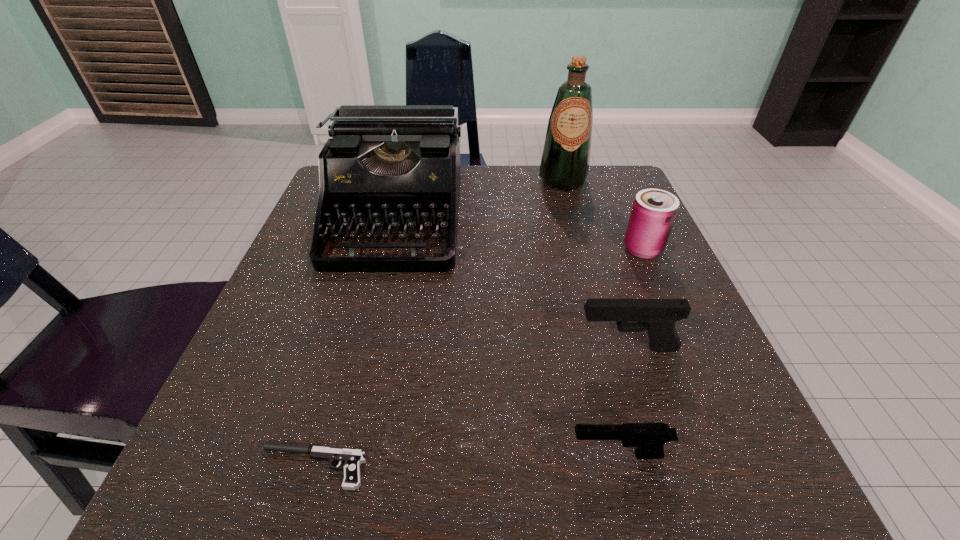
You are a GUI agent. You are given a task and a screenshot of the screen. Output one action in this format:
    pyautogui.click(x=<x>, y=<y>)
    Task: Click on the vacant space situated on the back of the can
    The width and height of the screenshot is (960, 540).
    Given the screenshot: What is the action you would take?
    pyautogui.click(x=627, y=213)

I want to click on blank space located 0.160m on the front-facing side of the tallest pistol, so click(474, 348).

Identify the location of vacant region located 0.190m on the front-facing side of the tallest pistol. Image resolution: width=960 pixels, height=540 pixels. (455, 348).

You are a GUI agent. You are given a task and a screenshot of the screen. Output one action in this format:
    pyautogui.click(x=<x>, y=<y>)
    Task: Click on the vacant space located 0.260m on the front-facing side of the tallest pistol
    Image resolution: width=960 pixels, height=540 pixels.
    Given the screenshot: What is the action you would take?
    pyautogui.click(x=411, y=348)

Where is `vacant space located on the front-facing side of the fifth tallest object`? This screenshot has width=960, height=540. vacant space located on the front-facing side of the fifth tallest object is located at coordinates (475, 455).

The height and width of the screenshot is (540, 960). Find the location of `free space located 0.140m on the front-facing side of the fifth tallest object`. free space located 0.140m on the front-facing side of the fifth tallest object is located at coordinates (460, 455).

In order to click on free space located 0.240m on the front-facing side of the fifth tallest object in this screenshot , I will do point(382,455).

The height and width of the screenshot is (540, 960). I want to click on blank space located 0.050m on the front-facing side of the shortest pistol, so click(x=219, y=467).

The image size is (960, 540). Identify the location of olive oil positioned at the far edge. (564, 166).

The height and width of the screenshot is (540, 960). I want to click on typewriter that is at the far edge, so click(389, 167).